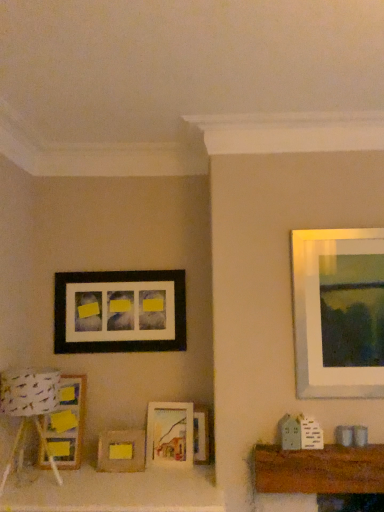
Find the location of `white paper lampshade at lower left`. white paper lampshade at lower left is located at coordinates (29, 408).

Find the location of `matte black picture frame at upper left, the 1th picture frame in the top-to-bottom sequence`. matte black picture frame at upper left, the 1th picture frame in the top-to-bottom sequence is located at coordinates (120, 311).

Describe the element at coordinates (201, 435) in the screenshot. I see `wooden picture frame at center, which is the 2th picture frame from bottom to top` at that location.

What are the coordinates of `matte wood picture frame at center, which is counted as the 5th picture frame, starting from the top` in the screenshot? It's located at (121, 451).

I want to click on white paper lampshade at lower left, so click(x=29, y=408).

Between matte wood picture frame at center, marked as the first picture frame in a bottom-to-top arrangement, and matte wooden picture frame at lower left, which ranks as the second picture frame in top-to-bottom order, which one appears on the left side from the viewer's perspective?

matte wooden picture frame at lower left, which ranks as the second picture frame in top-to-bottom order.

From the image's perspective, is matte wood picture frame at center, marked as the first picture frame in a bottom-to-top arrangement, positioned above or below matte wooden picture frame at lower left, which ranks as the second picture frame in top-to-bottom order?

Clearly, from the image's perspective, matte wood picture frame at center, marked as the first picture frame in a bottom-to-top arrangement, is below matte wooden picture frame at lower left, which ranks as the second picture frame in top-to-bottom order.

Is matte wood picture frame at center, which is counted as the 5th picture frame, starting from the top, beside matte wooden picture frame at lower left, the 4th picture frame from the bottom?

They are not placed beside each other.

How different are the orientations of matte wood picture frame at center, which is counted as the 5th picture frame, starting from the top, and matte wooden picture frame at lower left, which ranks as the second picture frame in top-to-bottom order, in degrees?

The angular difference between matte wood picture frame at center, which is counted as the 5th picture frame, starting from the top, and matte wooden picture frame at lower left, which ranks as the second picture frame in top-to-bottom order, is 1.95 degrees.

Which object is closer to the camera taking this photo, matte wooden picture frame at lower left, the 4th picture frame from the bottom, or wooden picture frame at center, which is the 2th picture frame from bottom to top?

matte wooden picture frame at lower left, the 4th picture frame from the bottom, is closer to the camera.

From the image's perspective, relative to wooden picture frame at center, which ranks as the fourth picture frame in top-to-bottom order, is matte wooden picture frame at lower left, which ranks as the second picture frame in top-to-bottom order, above or below?

From the image's perspective, matte wooden picture frame at lower left, which ranks as the second picture frame in top-to-bottom order, appears above wooden picture frame at center, which ranks as the fourth picture frame in top-to-bottom order.

Considering the sizes of objects matte wooden picture frame at lower left, which ranks as the second picture frame in top-to-bottom order, and wooden picture frame at center, which is the 2th picture frame from bottom to top, in the image provided, who is bigger, matte wooden picture frame at lower left, which ranks as the second picture frame in top-to-bottom order, or wooden picture frame at center, which is the 2th picture frame from bottom to top,?

Bigger between the two is matte wooden picture frame at lower left, which ranks as the second picture frame in top-to-bottom order.

From a real-world perspective, is matte wooden picture frame at lower left, which ranks as the second picture frame in top-to-bottom order, over wooden picture frame at center, which is the 2th picture frame from bottom to top?

Yes, from a real-world perspective, matte wooden picture frame at lower left, which ranks as the second picture frame in top-to-bottom order, is over wooden picture frame at center, which is the 2th picture frame from bottom to top

Is matte wood picture frame at center, marked as the first picture frame in a bottom-to-top arrangement, completely or partially inside matte black picture frame at upper left, the 1th picture frame in the top-to-bottom sequence?

No, matte wood picture frame at center, marked as the first picture frame in a bottom-to-top arrangement, is located outside of matte black picture frame at upper left, the 1th picture frame in the top-to-bottom sequence.

Which object is positioned more to the left, matte black picture frame at upper left, placed as the 5th picture frame when sorted from bottom to top, or matte wood picture frame at center, which is counted as the 5th picture frame, starting from the top?

Positioned to the left is matte black picture frame at upper left, placed as the 5th picture frame when sorted from bottom to top.

Is matte black picture frame at upper left, the 1th picture frame in the top-to-bottom sequence, in contact with matte wood picture frame at center, marked as the first picture frame in a bottom-to-top arrangement?

matte black picture frame at upper left, the 1th picture frame in the top-to-bottom sequence, and matte wood picture frame at center, marked as the first picture frame in a bottom-to-top arrangement, are not in contact.

Considering the relative positions of matte black picture frame at upper left, placed as the 5th picture frame when sorted from bottom to top, and wooden picture frame at center, which is the 2th picture frame from bottom to top, in the image provided, is matte black picture frame at upper left, placed as the 5th picture frame when sorted from bottom to top, to the left or to the right of wooden picture frame at center, which is the 2th picture frame from bottom to top,?

matte black picture frame at upper left, placed as the 5th picture frame when sorted from bottom to top, is positioned on wooden picture frame at center, which is the 2th picture frame from bottom to top,'s left side.

Is the depth of matte black picture frame at upper left, the 1th picture frame in the top-to-bottom sequence, less than that of wooden picture frame at center, which ranks as the fourth picture frame in top-to-bottom order?

No, the depth of matte black picture frame at upper left, the 1th picture frame in the top-to-bottom sequence, is greater than that of wooden picture frame at center, which ranks as the fourth picture frame in top-to-bottom order.

Based on the photo, how many degrees apart are the facing directions of matte black picture frame at upper left, placed as the 5th picture frame when sorted from bottom to top, and wooden picture frame at center, which is the 2th picture frame from bottom to top?

There is a 9.89-degree angle between the facing directions of matte black picture frame at upper left, placed as the 5th picture frame when sorted from bottom to top, and wooden picture frame at center, which is the 2th picture frame from bottom to top.

In the scene shown: Considering the sizes of objects matte black picture frame at upper left, the 1th picture frame in the top-to-bottom sequence, and wooden picture frame at center, which is the 2th picture frame from bottom to top, in the image provided, who is smaller, matte black picture frame at upper left, the 1th picture frame in the top-to-bottom sequence, or wooden picture frame at center, which is the 2th picture frame from bottom to top,?

wooden picture frame at center, which is the 2th picture frame from bottom to top, is smaller.

Between point (161, 459) and point (203, 414), which one is positioned in front?

Positioned in front is point (161, 459).

How much distance is there between matte wooden picture frame at center, which is the third picture frame in top-to-bottom order, and wooden picture frame at center, which is the 2th picture frame from bottom to top?

matte wooden picture frame at center, which is the third picture frame in top-to-bottom order, is 12.89 centimeters from wooden picture frame at center, which is the 2th picture frame from bottom to top.

Which of these two, matte wooden picture frame at center, which is the third picture frame in top-to-bottom order, or wooden picture frame at center, which ranks as the fourth picture frame in top-to-bottom order, is bigger?

Bigger between the two is matte wooden picture frame at center, which is the third picture frame in top-to-bottom order.

How many degrees apart are the facing directions of white paper lampshade at lower left and matte black picture frame at upper left, the 1th picture frame in the top-to-bottom sequence?

They differ by 5.44 degrees in their facing directions.

Looking at their sizes, would you say white paper lampshade at lower left is wider or thinner than matte black picture frame at upper left, the 1th picture frame in the top-to-bottom sequence?

Clearly, white paper lampshade at lower left has more width compared to matte black picture frame at upper left, the 1th picture frame in the top-to-bottom sequence.

Is white paper lampshade at lower left bigger or smaller than matte black picture frame at upper left, placed as the 5th picture frame when sorted from bottom to top?

In the image, white paper lampshade at lower left appears to be larger than matte black picture frame at upper left, placed as the 5th picture frame when sorted from bottom to top.

Is white paper lampshade at lower left positioned behind matte black picture frame at upper left, the 1th picture frame in the top-to-bottom sequence?

No, the depth of white paper lampshade at lower left is less than that of matte black picture frame at upper left, the 1th picture frame in the top-to-bottom sequence.

From the image's perspective, between white paper lampshade at lower left and matte wooden picture frame at center, the third picture frame positioned from the bottom, who is located below?

matte wooden picture frame at center, the third picture frame positioned from the bottom, appears lower in the image.

Considering the relative sizes of white paper lampshade at lower left and matte wooden picture frame at center, the third picture frame positioned from the bottom, in the image provided, is white paper lampshade at lower left taller than matte wooden picture frame at center, the third picture frame positioned from the bottom,?

Yes.

Is white paper lampshade at lower left inside the boundaries of matte wooden picture frame at center, the third picture frame positioned from the bottom, or outside?

white paper lampshade at lower left lies outside matte wooden picture frame at center, the third picture frame positioned from the bottom.

The width and height of the screenshot is (384, 512). There is a matte wooden picture frame at lower left, which ranks as the second picture frame in top-to-bottom order. Find the location of `the 3rd picture frame below it (from the image's perspective)`. the 3rd picture frame below it (from the image's perspective) is located at coordinates (121, 451).

Where is `the 4th picture frame to the left of the wooden picture frame at center, which is the 2th picture frame from bottom to top, counting from the anchor's position`? This screenshot has width=384, height=512. the 4th picture frame to the left of the wooden picture frame at center, which is the 2th picture frame from bottom to top, counting from the anchor's position is located at coordinates (67, 422).

Considering their positions, is matte black picture frame at upper left, the 1th picture frame in the top-to-bottom sequence, positioned further to matte wooden picture frame at lower left, the 4th picture frame from the bottom, than matte wooden picture frame at center, which is the third picture frame in top-to-bottom order?

Among the two, matte wooden picture frame at center, which is the third picture frame in top-to-bottom order, is located further to matte wooden picture frame at lower left, the 4th picture frame from the bottom.

Based on their spatial positions, is wooden picture frame at center, which is the 2th picture frame from bottom to top, or matte wood picture frame at center, marked as the first picture frame in a bottom-to-top arrangement, further from white paper lampshade at lower left?

wooden picture frame at center, which is the 2th picture frame from bottom to top, is further to white paper lampshade at lower left.

Considering their positions, is matte wooden picture frame at lower left, the 4th picture frame from the bottom, positioned closer to white paper lampshade at lower left than matte wood picture frame at center, marked as the first picture frame in a bottom-to-top arrangement?

matte wooden picture frame at lower left, the 4th picture frame from the bottom.

Considering their positions, is matte wood picture frame at center, which is counted as the 5th picture frame, starting from the top, positioned closer to white paper lampshade at lower left than matte wooden picture frame at lower left, which ranks as the second picture frame in top-to-bottom order?

The object closer to white paper lampshade at lower left is matte wooden picture frame at lower left, which ranks as the second picture frame in top-to-bottom order.

Looking at the image, which one is located further to matte black picture frame at upper left, the 1th picture frame in the top-to-bottom sequence, wooden picture frame at center, which ranks as the fourth picture frame in top-to-bottom order, or matte wooden picture frame at center, which is the third picture frame in top-to-bottom order?

wooden picture frame at center, which ranks as the fourth picture frame in top-to-bottom order.

From the image, which object appears to be nearer to matte wood picture frame at center, marked as the first picture frame in a bottom-to-top arrangement, wooden picture frame at center, which ranks as the fourth picture frame in top-to-bottom order, or matte wooden picture frame at center, the third picture frame positioned from the bottom?

The object closer to matte wood picture frame at center, marked as the first picture frame in a bottom-to-top arrangement, is matte wooden picture frame at center, the third picture frame positioned from the bottom.

Estimate the real-world distances between objects in this image. Which object is further from wooden picture frame at center, which is the 2th picture frame from bottom to top, matte wooden picture frame at lower left, which ranks as the second picture frame in top-to-bottom order, or white paper lampshade at lower left?

white paper lampshade at lower left is positioned further to the anchor wooden picture frame at center, which is the 2th picture frame from bottom to top.

Based on their spatial positions, is matte wooden picture frame at lower left, the 4th picture frame from the bottom, or white paper lampshade at lower left further from matte black picture frame at upper left, placed as the 5th picture frame when sorted from bottom to top?

white paper lampshade at lower left is positioned further to the anchor matte black picture frame at upper left, placed as the 5th picture frame when sorted from bottom to top.

Identify the location of lamp between matte black picture frame at upper left, the 1th picture frame in the top-to-bottom sequence, and matte wooden picture frame at center, the third picture frame positioned from the bottom, vertically. (29, 408).

You are a GUI agent. You are given a task and a screenshot of the screen. Output one action in this format:
    pyautogui.click(x=<x>, y=<y>)
    Task: Click on the lamp between matte black picture frame at upper left, the 1th picture frame in the top-to-bottom sequence, and matte wooden picture frame at lower left, the 4th picture frame from the bottom, in the up-down direction
    The height and width of the screenshot is (512, 384).
    Given the screenshot: What is the action you would take?
    pyautogui.click(x=29, y=408)

At what (x,y) coordinates should I click in order to perform the action: click on lamp between matte black picture frame at upper left, the 1th picture frame in the top-to-bottom sequence, and matte wood picture frame at center, which is counted as the 5th picture frame, starting from the top, in the vertical direction. Please return your answer as a coordinate pair (x, y). The width and height of the screenshot is (384, 512). Looking at the image, I should click on (29, 408).

The image size is (384, 512). I want to click on picture frame between matte black picture frame at upper left, placed as the 5th picture frame when sorted from bottom to top, and matte wooden picture frame at center, the third picture frame positioned from the bottom, in the vertical direction, so click(x=67, y=422).